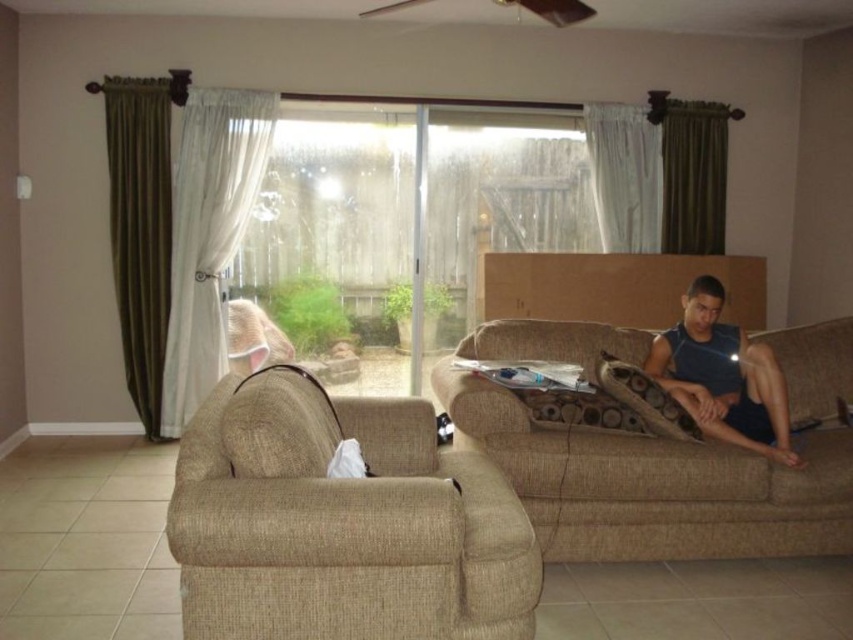
Does beige fabric armchair at left have a lesser width compared to dark blue tank top at right?

No.

Who is positioned more to the right, beige fabric armchair at left or dark blue tank top at right?

dark blue tank top at right is more to the right.

Who is more distant from viewer, (x=283, y=518) or (x=782, y=426)?

The point (x=782, y=426) is behind.

What are the coordinates of `beige fabric armchair at left` in the screenshot? It's located at [x=341, y=524].

Is beige fabric armchair at left wider than beige fabric couch at right?

Incorrect, beige fabric armchair at left's width does not surpass beige fabric couch at right's.

Does point (322, 392) come farther from viewer compared to point (796, 352)?

That is False.

Who is more forward, (448,538) or (543,324)?

Point (448,538) is more forward.

What are the coordinates of `beige fabric armchair at left` in the screenshot? It's located at (341, 524).

Is point (328, 438) less distant than point (554, 387)?

Yes, it is.

Is beige fabric armchair at left further to the viewer compared to matte plastic magazine at center?

No.

Is point (384, 413) farther from viewer compared to point (561, 362)?

No, it is in front of (561, 362).

Image resolution: width=853 pixels, height=640 pixels. In order to click on beige fabric armchair at left in this screenshot , I will do `click(341, 524)`.